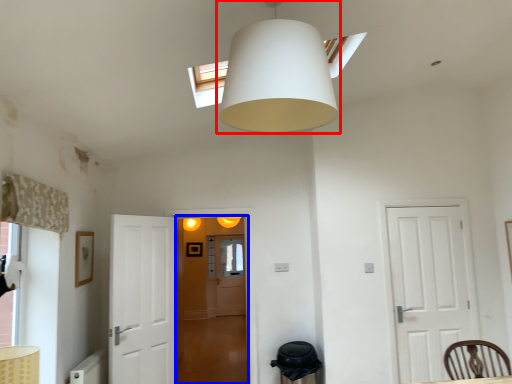
Question: Which object appears closest to the camera in this image, lamp (highlighted by a red box) or glass door (highlighted by a blue box)?

Choices:
 (A) lamp
 (B) glass door

Answer: (A)